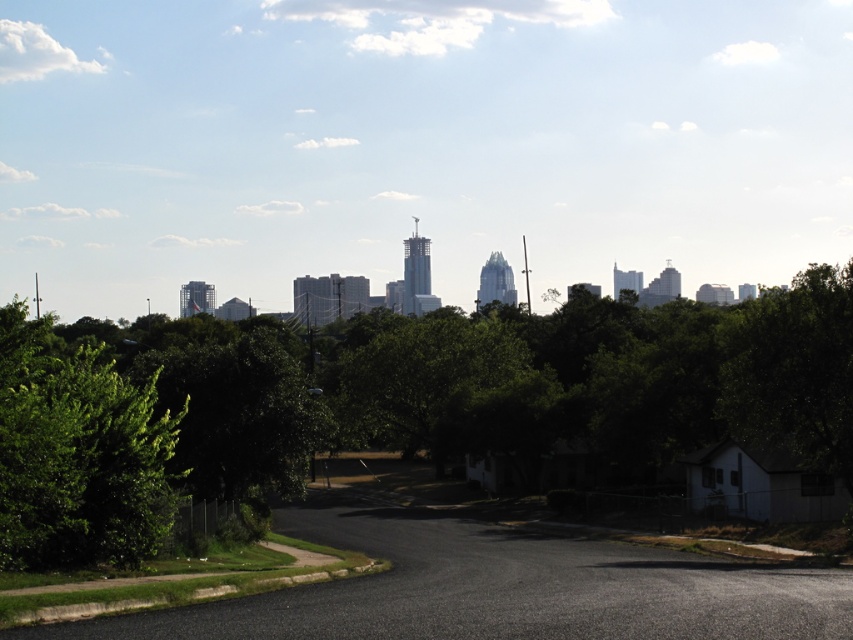
Question: Does green leafy tree at center appear on the left side of green leafy tree at left?

Choices:
 (A) yes
 (B) no

Answer: (B)

Question: Is green leafy tree at center to the right of green leafy tree at left from the viewer's perspective?

Choices:
 (A) yes
 (B) no

Answer: (A)

Question: Which object appears farthest from the camera in this image?

Choices:
 (A) green leafy tree at center
 (B) green leafy tree at left

Answer: (A)

Question: Does green leafy tree at center appear over green leafy tree at left?

Choices:
 (A) no
 (B) yes

Answer: (B)

Question: Which point appears farthest from the camera in this image?

Choices:
 (A) (746, 424)
 (B) (160, 456)

Answer: (A)